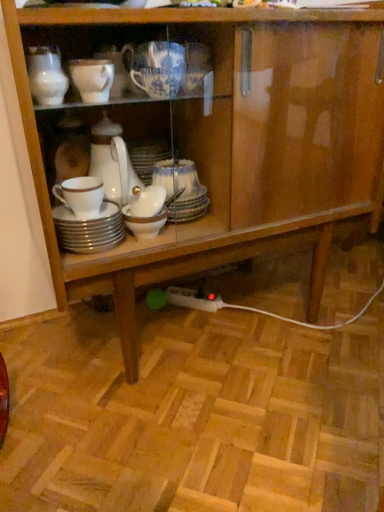
Question: Does point (109, 223) appear closer or farther from the camera than point (158, 83)?

Choices:
 (A) closer
 (B) farther

Answer: (B)

Question: In terms of height, does white glossy plates at center, which is counted as the 1th tableware, starting from the left, look taller or shorter compared to blue and white porcelain cup at upper center, the second tableware in the bottom-to-top sequence?

Choices:
 (A) tall
 (B) short

Answer: (B)

Question: From the image's perspective, is white glossy plates at center, the 2th tableware in the top-to-bottom sequence, located above or below blue and white porcelain cup at upper center, acting as the 1th tableware starting from the top?

Choices:
 (A) above
 (B) below

Answer: (B)

Question: Relative to white glossy plates at center, which is counted as the 1th tableware, starting from the left, is blue and white porcelain cup at upper center, which ranks as the 1th tableware in right-to-left order, in front or behind?

Choices:
 (A) front
 (B) behind

Answer: (A)

Question: Does point (155, 60) appear closer or farther from the camera than point (119, 220)?

Choices:
 (A) closer
 (B) farther

Answer: (A)

Question: Is blue and white porcelain cup at upper center, which ranks as the 1th tableware in right-to-left order, wider or thinner than white glossy plates at center, which is the 2th tableware in right-to-left order?

Choices:
 (A) thin
 (B) wide

Answer: (A)

Question: From a real-world perspective, is blue and white porcelain cup at upper center, acting as the 1th tableware starting from the top, positioned above or below white glossy plates at center, which ranks as the first tableware in bottom-to-top order?

Choices:
 (A) below
 (B) above

Answer: (B)